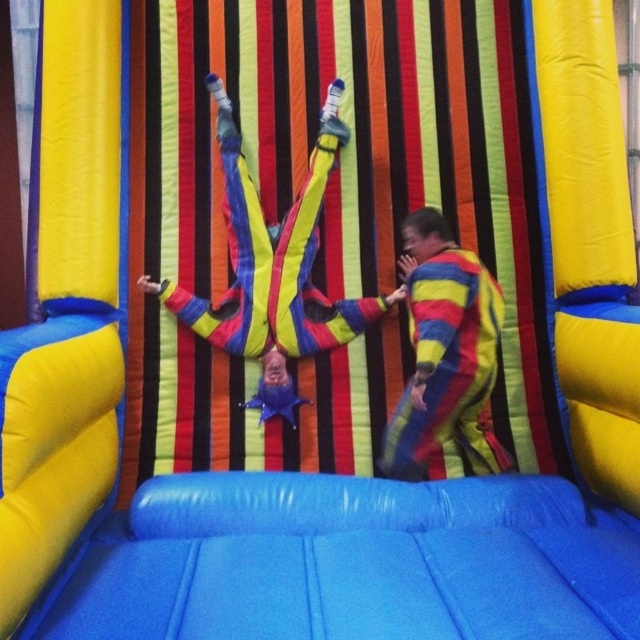
Question: In this image, where is striped fabric pants at center located relative to striped fabric clown at center?

Choices:
 (A) right
 (B) left

Answer: (B)

Question: From the image, what is the correct spatial relationship of striped fabric pants at center in relation to striped fabric clown at center?

Choices:
 (A) below
 (B) above

Answer: (B)

Question: Where is striped fabric pants at center located in relation to striped fabric clown at center in the image?

Choices:
 (A) left
 (B) right

Answer: (A)

Question: Which object is farther from the camera taking this photo?

Choices:
 (A) striped fabric clown at center
 (B) striped fabric pants at center

Answer: (B)